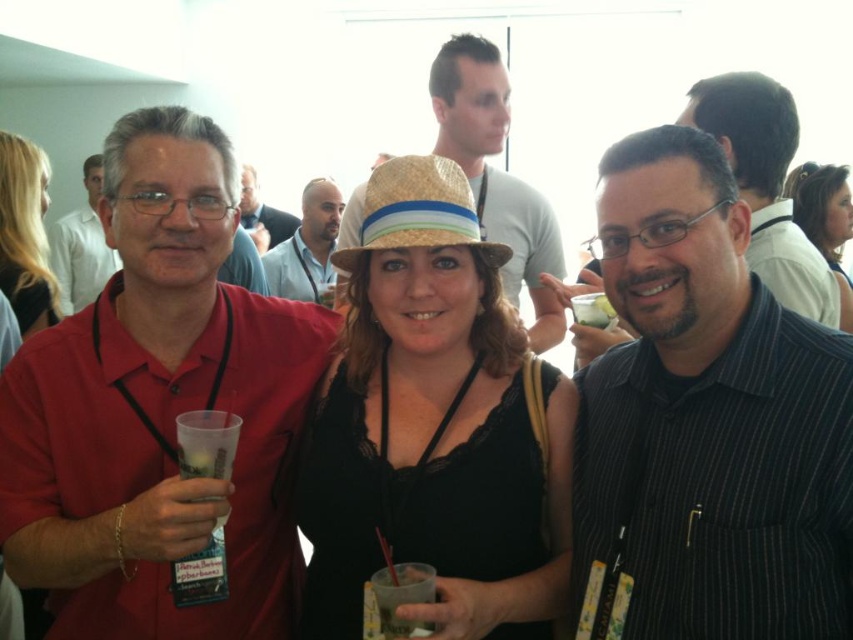
Does matte black shirt at center lie behind black fabric dress at center?

That is False.

Who is more forward, (757, 156) or (827, 176)?

Point (757, 156)

Locate an element on the screen. The width and height of the screenshot is (853, 640). matte black shirt at center is located at coordinates (764, 184).

Who is positioned more to the left, matte red shirt at center or clear plastic cup at center?

matte red shirt at center is more to the left.

Does matte red shirt at center appear on the left side of clear plastic cup at center?

Yes, matte red shirt at center is to the left of clear plastic cup at center.

Who is more forward, (x=93, y=237) or (x=584, y=323)?

Point (x=584, y=323) is in front.

Locate an element on the screen. matte red shirt at center is located at coordinates (82, 244).

Can you confirm if black striped shirt at center is bigger than smooth light blue shirt at center?

No.

Is black striped shirt at center closer to the viewer compared to smooth light blue shirt at center?

Yes, it is in front of smooth light blue shirt at center.

Who is more forward, (788, 563) or (316, 243)?

Positioned in front is point (788, 563).

Image resolution: width=853 pixels, height=640 pixels. Find the location of `black striped shirt at center`. black striped shirt at center is located at coordinates (706, 422).